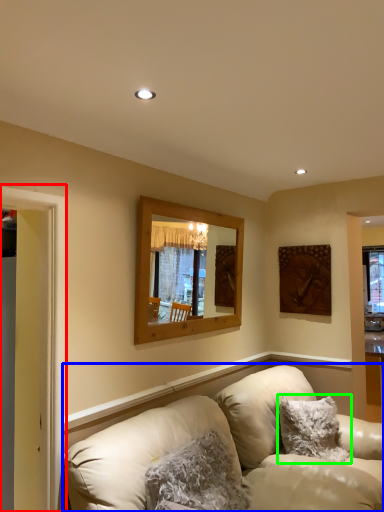
Question: Considering the real-world distances, which object is farthest from window frame (highlighted by a red box)? studio couch (highlighted by a blue box) or pillow (highlighted by a green box)?

Choices:
 (A) studio couch
 (B) pillow

Answer: (B)